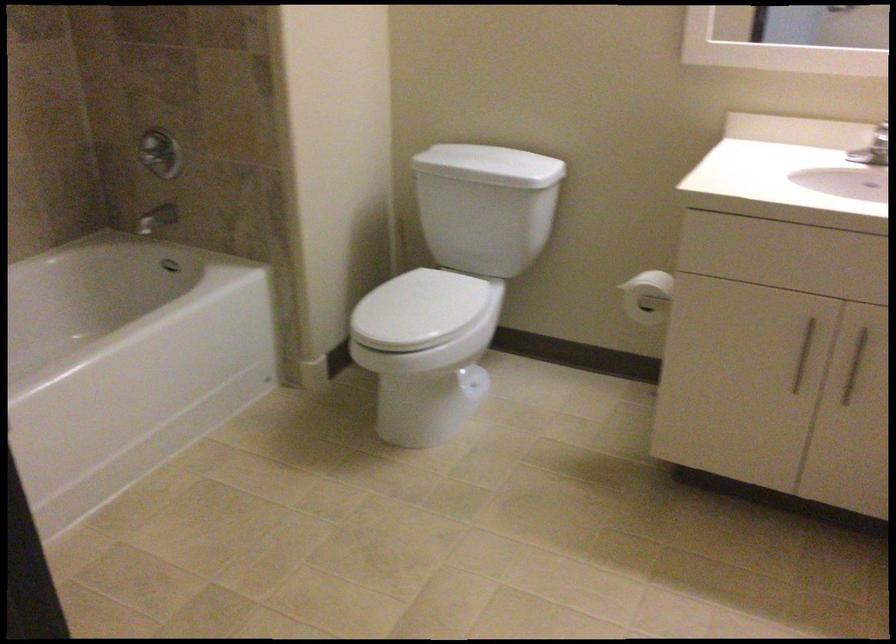
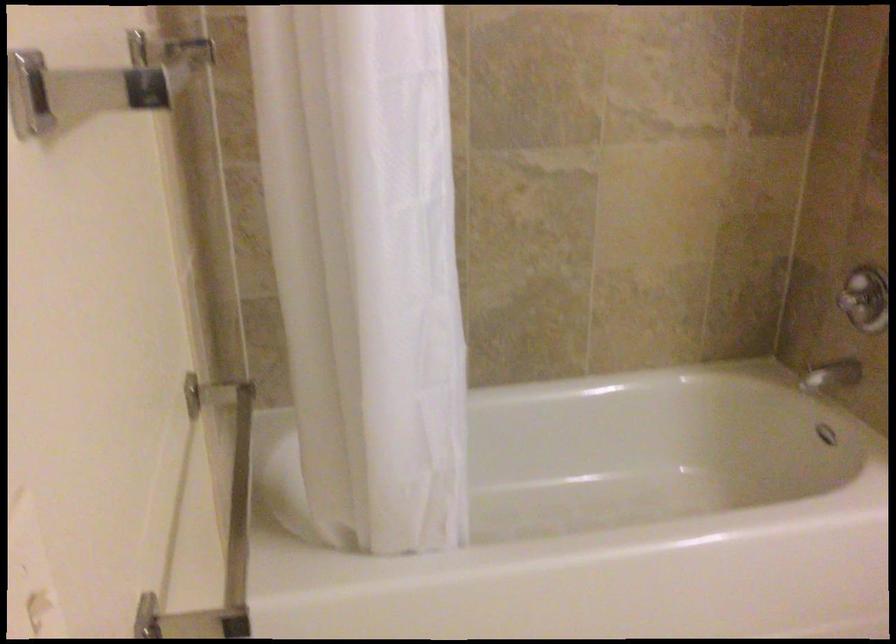
Question: The camera is either moving clockwise (left) or counter-clockwise (right) around the object. The first image is from the beginning of the video and the second image is from the end. Is the camera moving left or right when shooting the video?

Choices:
 (A) Left
 (B) Right

Answer: (B)